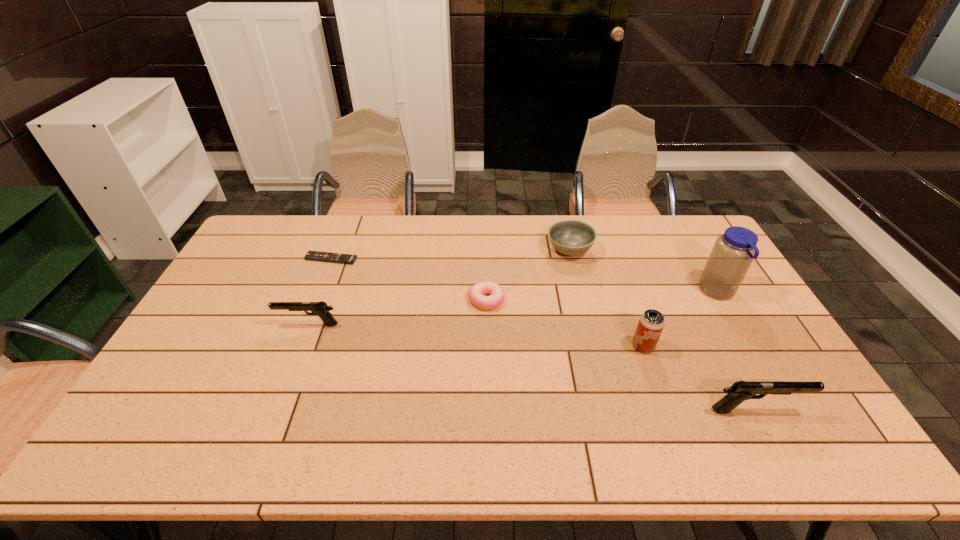
The image size is (960, 540). In order to click on vacant region located on the back of the doughnut in this screenshot , I will do pyautogui.click(x=486, y=246).

Locate an element on the screen. This screenshot has width=960, height=540. blank space located 0.140m on the front of the third object from right to left is located at coordinates (661, 399).

Find the location of a particular element. bowl that is at the far edge is located at coordinates (571, 238).

I want to click on remote control present at the far edge, so click(x=311, y=255).

Image resolution: width=960 pixels, height=540 pixels. Identify the location of object that is at the near edge. [740, 391].

Find the location of a particular element. gun that is at the right edge is located at coordinates (740, 391).

Image resolution: width=960 pixels, height=540 pixels. Identify the location of water bottle at the right edge. (733, 252).

Where is `object that is at the near right corner`? Image resolution: width=960 pixels, height=540 pixels. object that is at the near right corner is located at coordinates [740, 391].

Locate an element on the screen. vacant space at the far edge of the desktop is located at coordinates (357, 224).

The width and height of the screenshot is (960, 540). I want to click on free space at the near edge of the desktop, so click(269, 415).